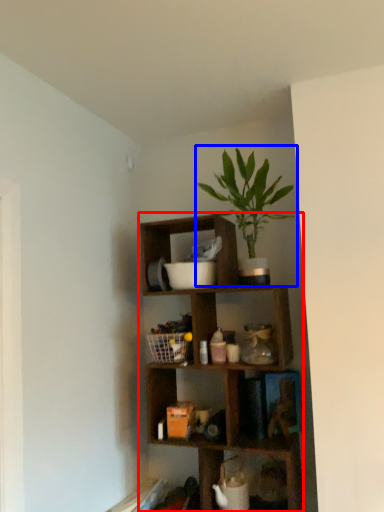
Question: Which object is further to the camera taking this photo, shelf (highlighted by a red box) or houseplant (highlighted by a blue box)?

Choices:
 (A) shelf
 (B) houseplant

Answer: (A)